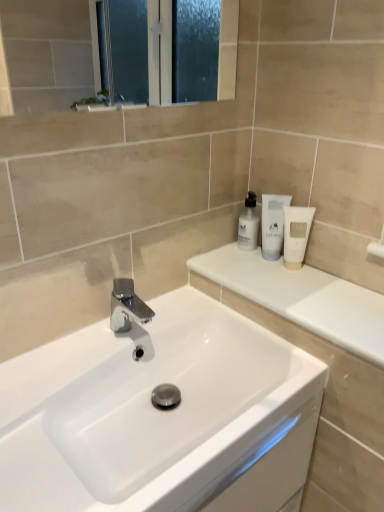
Identify the location of blank space to the left of white matte tube at upper right, the third toiletry viewed from the left. (242, 270).